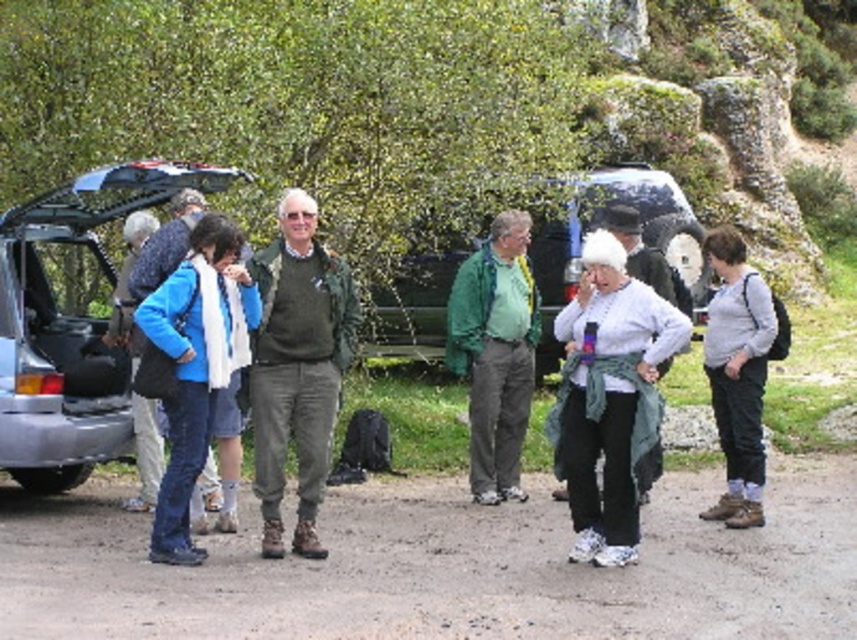
Looking at this image, who is shorter, matte blue jacket at center-left or gray cotton shirt at right?

gray cotton shirt at right

Is matte blue jacket at center-left thinner than gray cotton shirt at right?

Incorrect, matte blue jacket at center-left's width is not less than gray cotton shirt at right's.

Does point (198, 276) lie behind point (727, 493)?

No, (198, 276) is closer to viewer.

Locate an element on the screen. The image size is (857, 640). matte blue jacket at center-left is located at coordinates (196, 365).

Who is taller, green textured jacket at center or matte blue jacket at left?

green textured jacket at center is taller.

Can you confirm if green textured jacket at center is taller than matte blue jacket at left?

Yes, green textured jacket at center is taller than matte blue jacket at left.

Between point (526, 227) and point (153, 493), which one is positioned behind?

Point (526, 227)

Locate an element on the screen. The height and width of the screenshot is (640, 857). green textured jacket at center is located at coordinates (495, 353).

Does green matte sweater at center have a greater width compared to gray cotton shirt at right?

Yes.

Between green matte sweater at center and gray cotton shirt at right, which one is positioned higher?

green matte sweater at center is above.

Is point (310, 404) farther from viewer compared to point (727, 301)?

No.

Find the location of `green matte sweater at center`. green matte sweater at center is located at coordinates (297, 368).